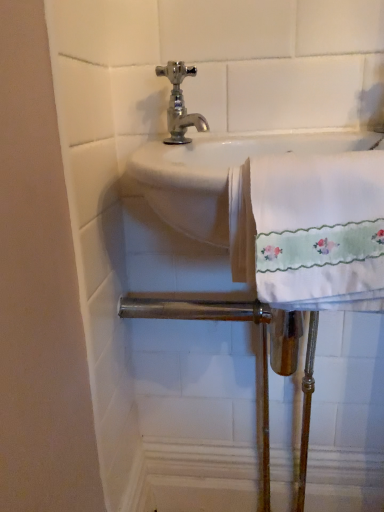
Describe the element at coordinates (180, 104) in the screenshot. The width and height of the screenshot is (384, 512). I see `chrome/metallic faucet at upper center` at that location.

Locate an element on the screen. chrome/metallic faucet at upper center is located at coordinates (180, 104).

At what (x,y) coordinates should I click in order to perform the action: click on white embroidered towel at right. Please return your answer as a coordinate pair (x, y). Looking at the image, I should click on (310, 230).

Measure the distance between point (259, 201) and camera.

Point (259, 201) is 39.70 centimeters away from camera.

What do you see at coordinates (310, 230) in the screenshot?
I see `white embroidered towel at right` at bounding box center [310, 230].

What are the coordinates of `chrome/metallic faucet at upper center` in the screenshot? It's located at (180, 104).

Visually, is chrome/metallic faucet at upper center positioned to the left or to the right of white embroidered towel at right?

From the image, it's evident that chrome/metallic faucet at upper center is to the left of white embroidered towel at right.

Does chrome/metallic faucet at upper center lie behind white embroidered towel at right?

Yes.

Is point (182, 137) positioned before point (234, 249)?

No, (182, 137) is further to viewer.

Looking at this image, from the image's perspective, between chrome/metallic faucet at upper center and white embroidered towel at right, which one is located above?

chrome/metallic faucet at upper center.

From a real-world perspective, who is located higher, chrome/metallic faucet at upper center or white embroidered towel at right?

chrome/metallic faucet at upper center is physically above.

Does chrome/metallic faucet at upper center have a lesser width compared to white embroidered towel at right?

Correct, the width of chrome/metallic faucet at upper center is less than that of white embroidered towel at right.

Considering the sizes of objects chrome/metallic faucet at upper center and white embroidered towel at right in the image provided, who is taller, chrome/metallic faucet at upper center or white embroidered towel at right?

white embroidered towel at right.

Considering the relative sizes of chrome/metallic faucet at upper center and white embroidered towel at right in the image provided, is chrome/metallic faucet at upper center bigger than white embroidered towel at right?

Incorrect, chrome/metallic faucet at upper center is not larger than white embroidered towel at right.

Is chrome/metallic faucet at upper center completely or partially outside of white embroidered towel at right?

chrome/metallic faucet at upper center is positioned outside white embroidered towel at right.

Are chrome/metallic faucet at upper center and white embroidered towel at right far apart?

chrome/metallic faucet at upper center is near white embroidered towel at right, not far away.

Is chrome/metallic faucet at upper center facing away from white embroidered towel at right?

No, chrome/metallic faucet at upper center's orientation is not away from white embroidered towel at right.

Locate an element on the screen. bath towel directly beneath the chrome/metallic faucet at upper center (from a real-world perspective) is located at coordinates (310, 230).

Which is more to the right, white embroidered towel at right or chrome/metallic faucet at upper center?

white embroidered towel at right is more to the right.

Does white embroidered towel at right come behind chrome/metallic faucet at upper center?

That is False.

Considering the points (377, 161) and (184, 74), which point is in front, point (377, 161) or point (184, 74)?

The point (377, 161) is closer to the camera.

From the image's perspective, which is below, white embroidered towel at right or chrome/metallic faucet at upper center?

white embroidered towel at right is shown below in the image.

From a real-world perspective, is white embroidered towel at right physically located above or below chrome/metallic faucet at upper center?

In terms of real-world spatial position, white embroidered towel at right is below chrome/metallic faucet at upper center.

Looking at their sizes, would you say white embroidered towel at right is wider or thinner than chrome/metallic faucet at upper center?

white embroidered towel at right is wider than chrome/metallic faucet at upper center.

Looking at this image, from their relative heights in the image, would you say white embroidered towel at right is taller or shorter than chrome/metallic faucet at upper center?

In the image, white embroidered towel at right appears to be taller than chrome/metallic faucet at upper center.

Can you confirm if white embroidered towel at right is smaller than chrome/metallic faucet at upper center?

Actually, white embroidered towel at right might be larger than chrome/metallic faucet at upper center.

Would you say white embroidered towel at right is inside or outside chrome/metallic faucet at upper center?

white embroidered towel at right is spatially situated outside chrome/metallic faucet at upper center.

Are white embroidered towel at right and chrome/metallic faucet at upper center far apart?

No, white embroidered towel at right is in close proximity to chrome/metallic faucet at upper center.

Consider the image. Is white embroidered towel at right facing away from chrome/metallic faucet at upper center?

No.

How distant is white embroidered towel at right from chrome/metallic faucet at upper center?

white embroidered towel at right is 11.29 inches from chrome/metallic faucet at upper center.

Identify the location of tap that is above the white embroidered towel at right (from the image's perspective). (180, 104).

At what (x,y) coordinates should I click in order to perform the action: click on bath towel located in front of the chrome/metallic faucet at upper center. Please return your answer as a coordinate pair (x, y). The width and height of the screenshot is (384, 512). Looking at the image, I should click on (310, 230).

In order to click on bath towel lying on the right of chrome/metallic faucet at upper center in this screenshot , I will do `click(310, 230)`.